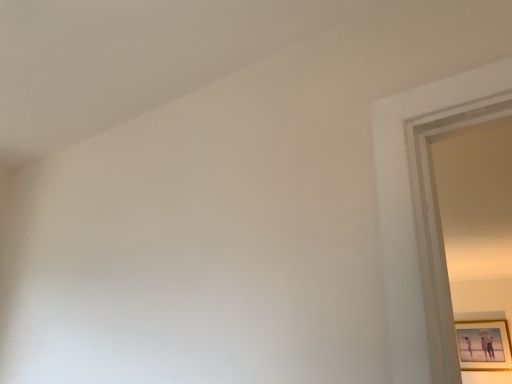
Describe the element at coordinates (483, 345) in the screenshot. I see `wooden framed picture at right` at that location.

Locate an element on the screen. wooden framed picture at right is located at coordinates (483, 345).

The image size is (512, 384). What are the coordinates of `wooden framed picture at right` in the screenshot? It's located at (483, 345).